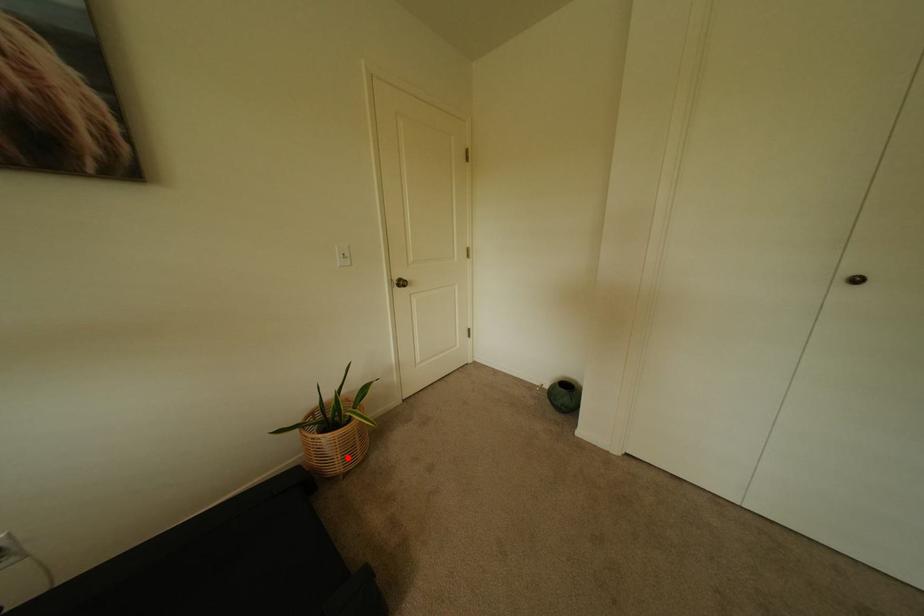
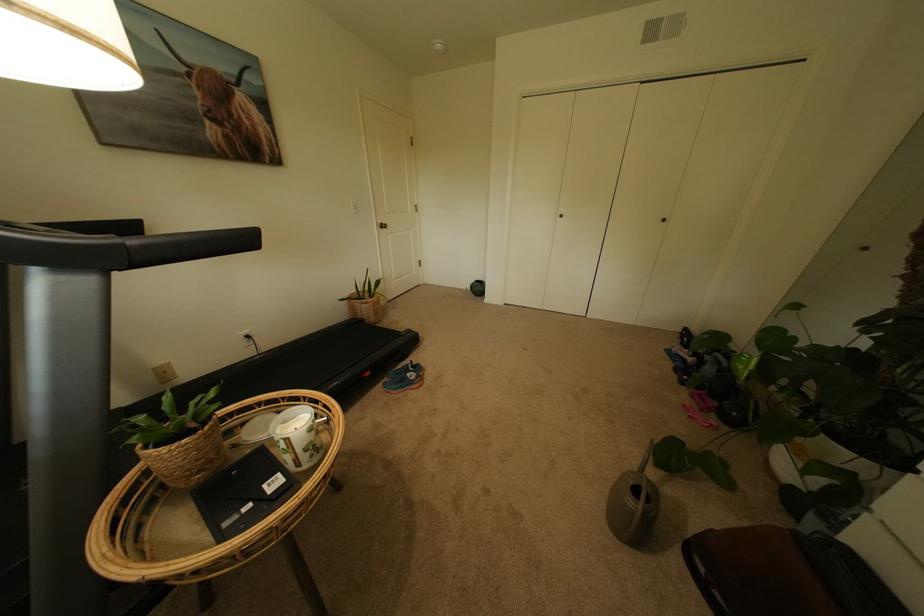
Question: I am providing you with two images of the same scene from different viewpoints. Image1 has a red point marked. In image2, the corresponding 3D location appears at what relative position? Reply with the corresponding letter.

Choices:
 (A) Closer
 (B) Farther

Answer: (A)